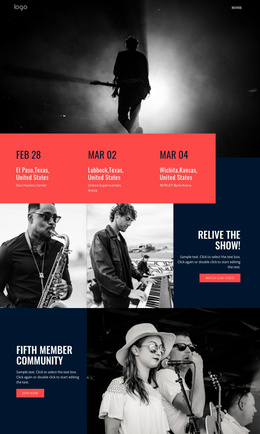
Find the location of `keyboard`. keyboard is located at coordinates (151, 294).